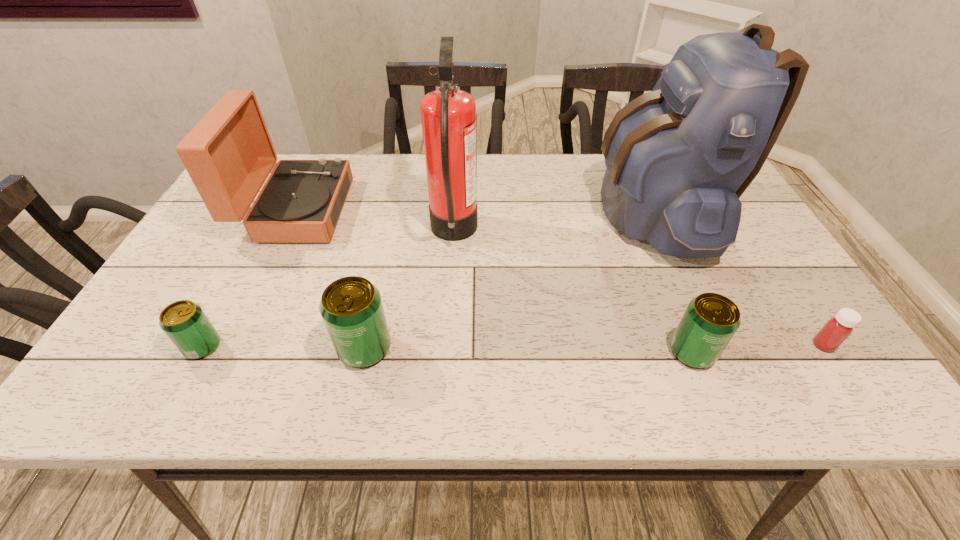
Image resolution: width=960 pixels, height=540 pixels. I want to click on blank space located 0.080m on the back of the third object from left to right, so click(375, 299).

This screenshot has width=960, height=540. In order to click on vacant space located on the right of the fifth tallest object in this screenshot , I will do `click(828, 352)`.

Find the location of a particular element. free space located on the face of the phonograph record is located at coordinates (388, 211).

This screenshot has height=540, width=960. Identify the location of vacant space located 0.380m on the front-facing side of the fire extinguisher. (622, 233).

Locate an element on the screen. vacant space located 0.370m at the front pocket of the backpack is located at coordinates (463, 212).

I want to click on vacant space situated at the front pocket of the backpack, so click(463, 212).

The image size is (960, 540). I want to click on free space located 0.390m at the front pocket of the backpack, so click(x=455, y=212).

At what (x,y) coordinates should I click in order to perform the action: click on free location located 0.190m on the left of the medicine. Please return your answer as a coordinate pair (x, y). The image size is (960, 540). Looking at the image, I should click on (721, 345).

Locate an element on the screen. phonograph record that is positioned at the far edge is located at coordinates (229, 154).

In order to click on backpack at the far edge in this screenshot , I will do `click(678, 158)`.